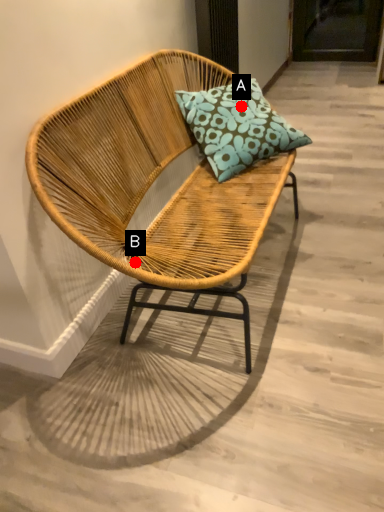
Question: Two points are circled on the image, labeled by A and B beside each circle. Which of the following is the closest to the observer?

Choices:
 (A) A is closer
 (B) B is closer

Answer: (B)